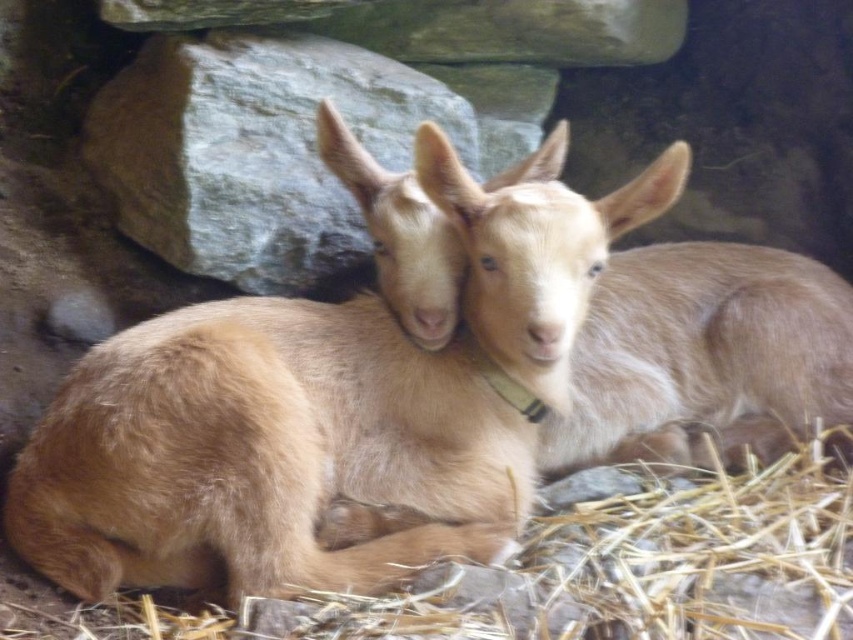
You are a photographer setting up a shot of the two goats resting on the brown straw at lower center and the light brown fur at center. Which object is positioned nearer to your camera lens?

The brown straw at lower center is closer to the viewer than the light brown fur at center, so the brown straw at lower center would be nearer to the camera lens.

You are a farmer who wants to separate the two light brown fur goats at center. The minimum distance required between them for safety is 40 centimeters. Can you determine if the current distance between the light brown fur goat at center and the light brown fur at center meets the safety requirement?

The light brown fur goat at center is 36.59 centimeters away from the light brown fur at center. Since the required minimum distance is 40 centimeters, the current distance does not meet the safety requirement.